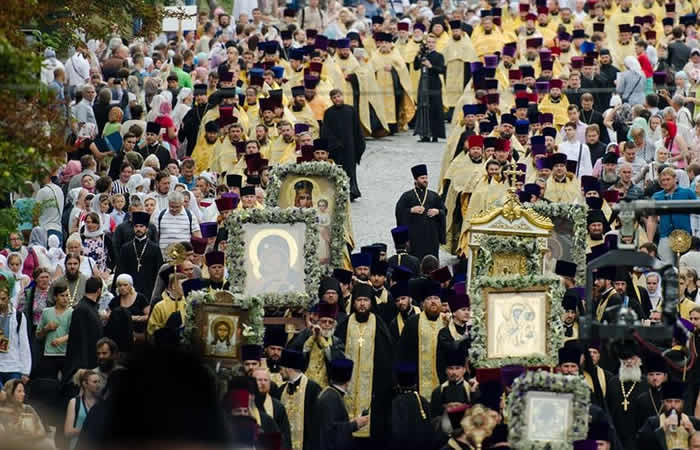
Image resolution: width=700 pixels, height=450 pixels. In order to click on picture of jesus in this screenshot , I will do `click(220, 333)`.